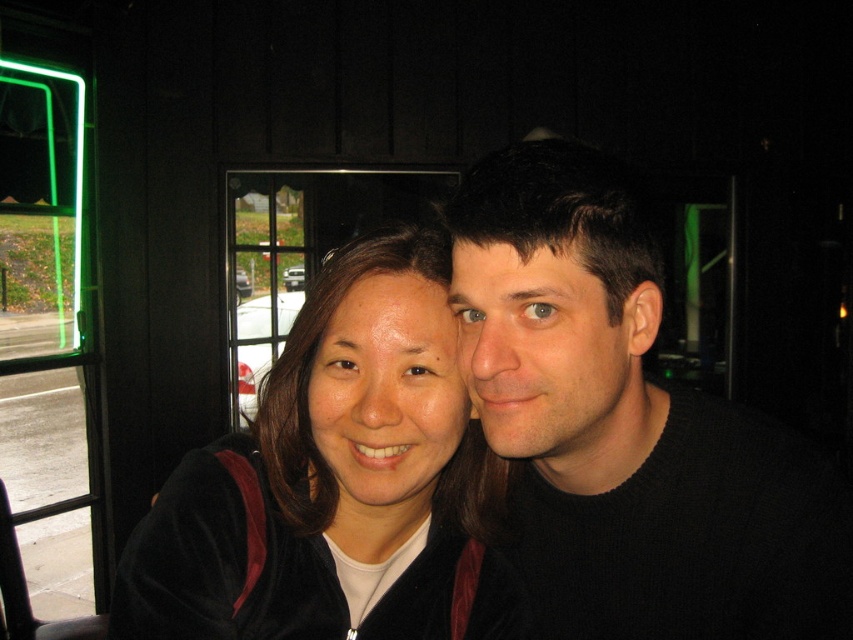
You are a photographer setting up a shot in a building with large windows. You have two subjects wearing the velvet black jacket at center and holding a green neon sign at left. To ensure the neon sign is visible in the photo, which object should be placed closer to the camera?

The velvet black jacket at center is shorter than the green neon sign at left, so to ensure the neon sign is visible, the green neon sign at left should be placed closer to the camera than the velvet black jacket at center.